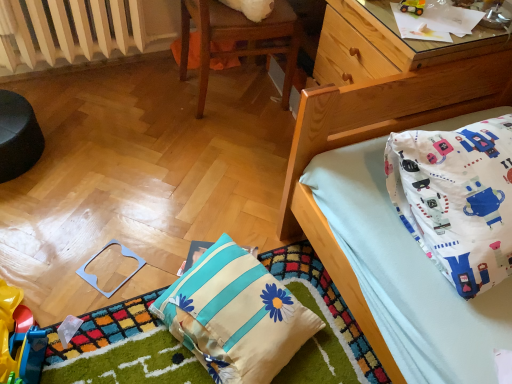
Identify the location of vacant area that is situated to the right of metallic yellow toy car at upper right, placed as the 1th toy when sorted from top to bottom. (466, 22).